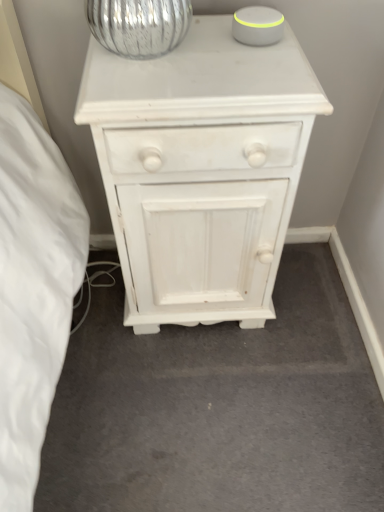
Question: Which direction should I rotate to look at white painted wood chest of drawers at center?

Choices:
 (A) left
 (B) right

Answer: (B)